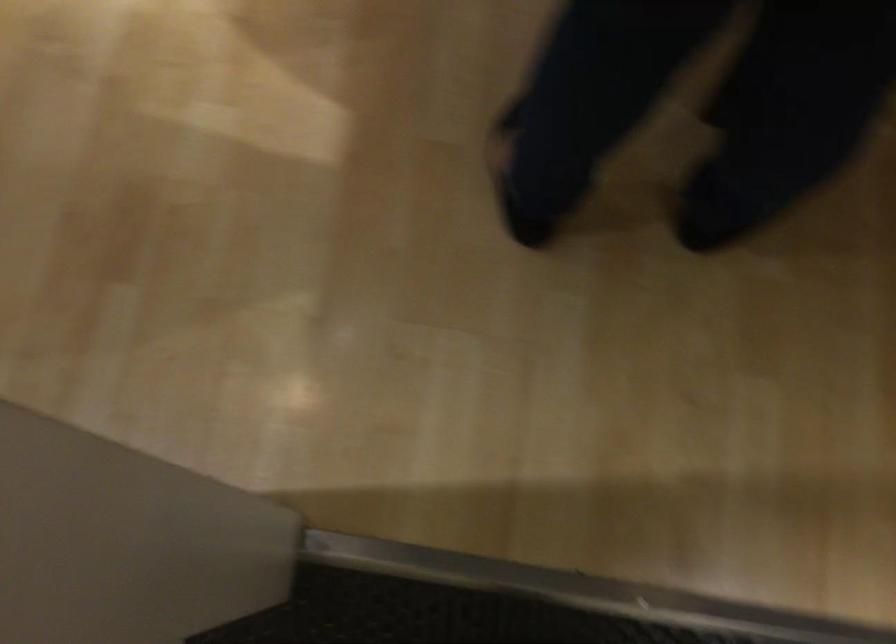
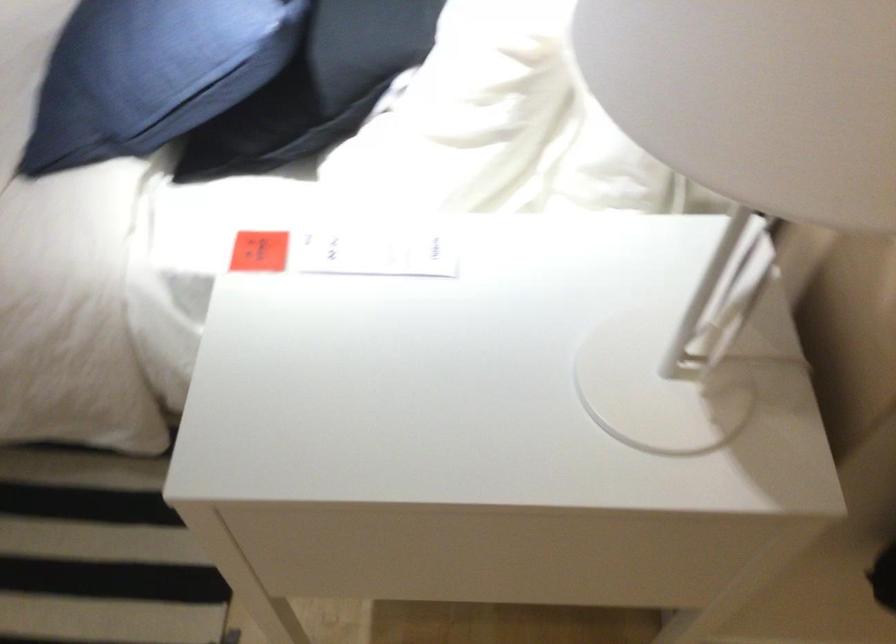
What movement of the cameraman would produce the second image?

The cameraman moved toward left, backward.